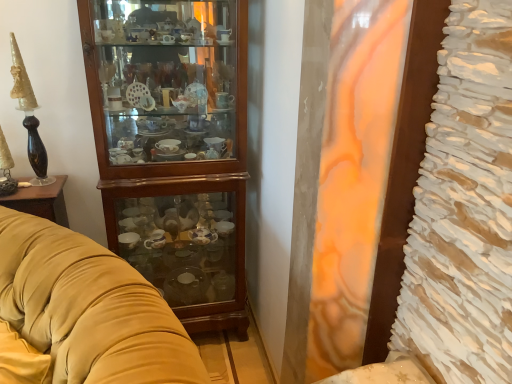
Question: From a real-world perspective, is velvet yellow couch at left physically located above or below wooden cabinet at left?

Choices:
 (A) below
 (B) above

Answer: (A)

Question: From the image's perspective, is velvet yellow couch at left positioned above or below wooden cabinet at left?

Choices:
 (A) below
 (B) above

Answer: (A)

Question: Is velvet yellow couch at left wider or thinner than wooden cabinet at left?

Choices:
 (A) thin
 (B) wide

Answer: (B)

Question: Is wooden cabinet at left inside the boundaries of velvet yellow couch at left, or outside?

Choices:
 (A) outside
 (B) inside

Answer: (A)

Question: Is wooden cabinet at left in front of or behind velvet yellow couch at left in the image?

Choices:
 (A) front
 (B) behind

Answer: (B)

Question: Looking at their shapes, would you say wooden cabinet at left is wider or thinner than velvet yellow couch at left?

Choices:
 (A) wide
 (B) thin

Answer: (B)

Question: In terms of size, does wooden cabinet at left appear bigger or smaller than velvet yellow couch at left?

Choices:
 (A) small
 (B) big

Answer: (A)